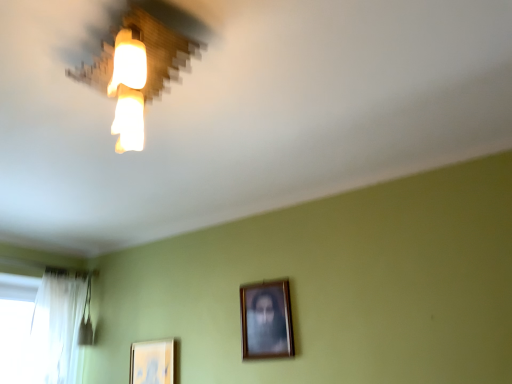
Question: Can you confirm if matte white picture frame at lower left, which is the first picture frame from left to right, is bigger than wooden lampshade at upper left?

Choices:
 (A) yes
 (B) no

Answer: (B)

Question: Is matte white picture frame at lower left, placed as the second picture frame when sorted from top to bottom, smaller than wooden lampshade at upper left?

Choices:
 (A) yes
 (B) no

Answer: (A)

Question: Is matte white picture frame at lower left, positioned as the 1th picture frame in bottom-to-top order, taller than wooden lampshade at upper left?

Choices:
 (A) no
 (B) yes

Answer: (A)

Question: Is matte white picture frame at lower left, arranged as the second picture frame when viewed from the right, looking in the opposite direction of wooden lampshade at upper left?

Choices:
 (A) yes
 (B) no

Answer: (B)

Question: Does matte white picture frame at lower left, which is the first picture frame from left to right, appear on the left side of wooden lampshade at upper left?

Choices:
 (A) yes
 (B) no

Answer: (A)

Question: Considering the relative positions of matte white picture frame at lower left, placed as the second picture frame when sorted from top to bottom, and wooden lampshade at upper left in the image provided, is matte white picture frame at lower left, placed as the second picture frame when sorted from top to bottom, to the right of wooden lampshade at upper left from the viewer's perspective?

Choices:
 (A) yes
 (B) no

Answer: (B)

Question: From a real-world perspective, is wooden framed portrait at center, the first picture frame positioned from the front, physically below white sheer curtain at left?

Choices:
 (A) no
 (B) yes

Answer: (B)

Question: Can you confirm if wooden framed portrait at center, which is the 2th picture frame from bottom to top, is wider than white sheer curtain at left?

Choices:
 (A) no
 (B) yes

Answer: (A)

Question: Is wooden framed portrait at center, the 1th picture frame from the top, to the left of white sheer curtain at left from the viewer's perspective?

Choices:
 (A) yes
 (B) no

Answer: (B)

Question: Considering the relative positions of wooden framed portrait at center, the 1th picture frame when ordered from right to left, and white sheer curtain at left in the image provided, is wooden framed portrait at center, the 1th picture frame when ordered from right to left, behind white sheer curtain at left?

Choices:
 (A) no
 (B) yes

Answer: (A)

Question: Can you confirm if wooden framed portrait at center, the 1th picture frame from the top, is bigger than white sheer curtain at left?

Choices:
 (A) yes
 (B) no

Answer: (B)

Question: Is wooden framed portrait at center, the 1th picture frame from the top, positioned in front of white sheer curtain at left?

Choices:
 (A) no
 (B) yes

Answer: (B)

Question: Is wooden lampshade at upper left smaller than white sheer curtain at left?

Choices:
 (A) yes
 (B) no

Answer: (A)